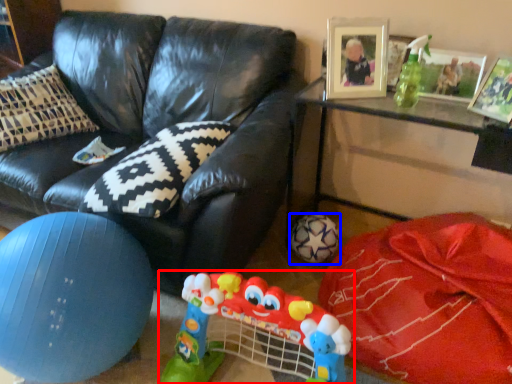
Question: Among these objects, which one is nearest to the camera, toy (highlighted by a red box) or football (highlighted by a blue box)?

Choices:
 (A) toy
 (B) football

Answer: (A)